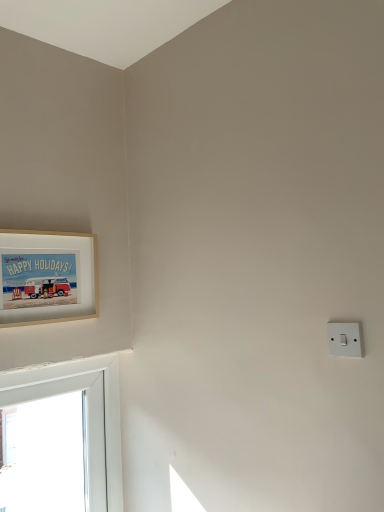
Question: Is white plastic light switch at right wider or thinner than wooden frame at upper left?

Choices:
 (A) wide
 (B) thin

Answer: (B)

Question: Is white plastic light switch at right taller or shorter than wooden frame at upper left?

Choices:
 (A) short
 (B) tall

Answer: (A)

Question: Based on their positions, is white plastic light switch at right located to the left or right of wooden frame at upper left?

Choices:
 (A) right
 (B) left

Answer: (A)

Question: Is wooden frame at upper left bigger or smaller than white plastic light switch at right?

Choices:
 (A) big
 (B) small

Answer: (A)

Question: From the image's perspective, is wooden frame at upper left positioned above or below white plastic light switch at right?

Choices:
 (A) below
 (B) above

Answer: (B)

Question: Considering their positions, is wooden frame at upper left located in front of or behind white plastic light switch at right?

Choices:
 (A) behind
 (B) front

Answer: (A)

Question: From their relative heights in the image, would you say wooden frame at upper left is taller or shorter than white plastic light switch at right?

Choices:
 (A) tall
 (B) short

Answer: (A)